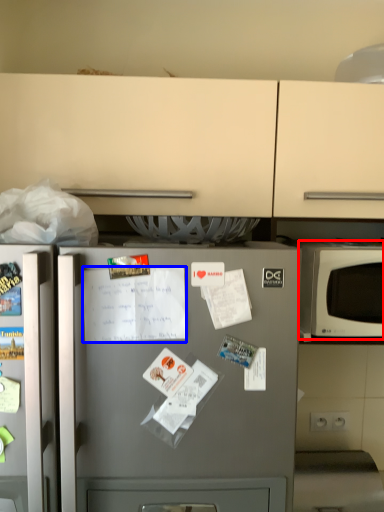
Question: Which point is further to the camera, microwave oven (highlighted by a red box) or receipt (highlighted by a blue box)?

Choices:
 (A) microwave oven
 (B) receipt

Answer: (A)